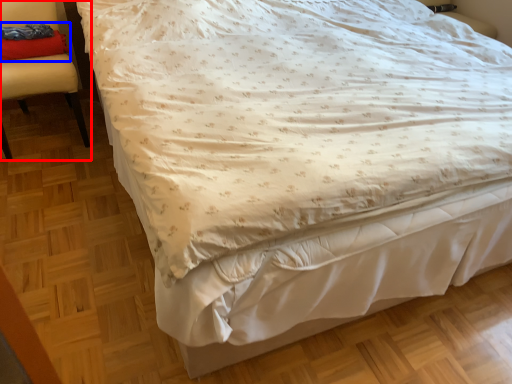
Question: Which object is further to the camera taking this photo, chair (highlighted by a red box) or pillow (highlighted by a blue box)?

Choices:
 (A) chair
 (B) pillow

Answer: (B)